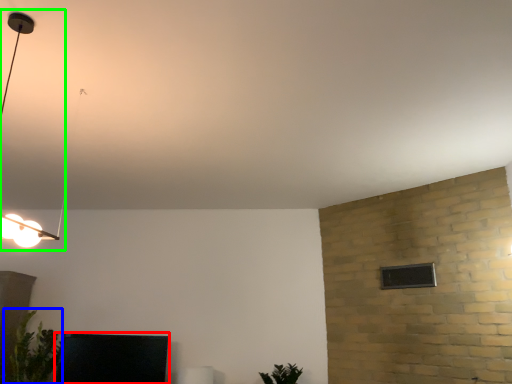
Question: Which object is positioned farthest from furniture (highlighted by a red box)? Select from plant (highlighted by a blue box) and lamp (highlighted by a green box).

Choices:
 (A) plant
 (B) lamp

Answer: (B)